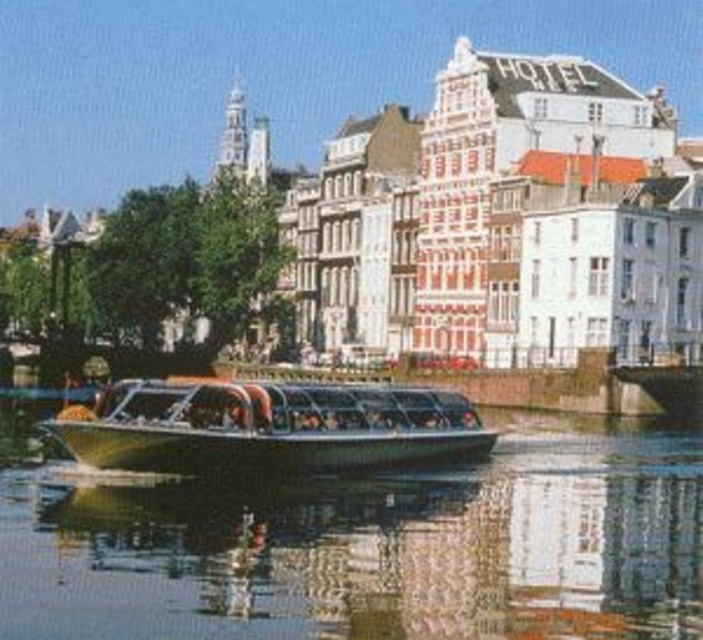
Who is lower down, metallic gray boat at center or metallic glass boat at center?

Positioned lower is metallic gray boat at center.

Is metallic gray boat at center positioned behind metallic glass boat at center?

No, metallic gray boat at center is closer to the viewer.

Between point (640, 625) and point (328, 458), which one is positioned behind?

The point (328, 458) is more distant.

At what (x,y) coordinates should I click in order to perform the action: click on metallic gray boat at center. Please return your answer as a coordinate pair (x, y). The height and width of the screenshot is (640, 703). Looking at the image, I should click on (370, 545).